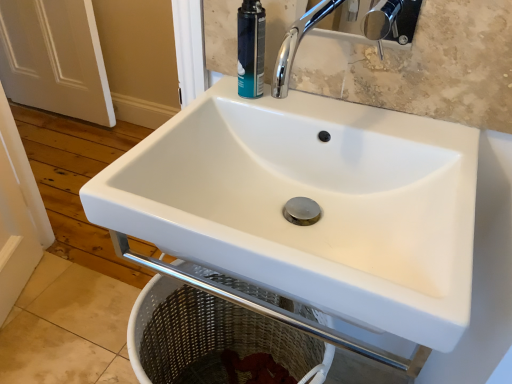
The image size is (512, 384). What do you see at coordinates (54, 58) in the screenshot?
I see `white matte door at left` at bounding box center [54, 58].

In order to click on white matte door at left in this screenshot , I will do pyautogui.click(x=54, y=58).

Locate an element on the screen. teal matte shaving cream can at upper center is located at coordinates (251, 49).

Does point (257, 37) lie in front of point (84, 89)?

Yes, point (257, 37) is closer to viewer.

Is teal matte shaving cream can at upper center completely or partially outside of white matte door at left?

Indeed, teal matte shaving cream can at upper center is completely outside white matte door at left.

Considering the sizes of objects teal matte shaving cream can at upper center and white matte door at left in the image provided, who is taller, teal matte shaving cream can at upper center or white matte door at left?

With more height is white matte door at left.

From the picture: Is teal matte shaving cream can at upper center to the left of white matte door at left from the viewer's perspective?

In fact, teal matte shaving cream can at upper center is to the right of white matte door at left.

Is point (263, 58) positioned before point (157, 238)?

That is False.

Is teal matte shaving cream can at upper center completely or partially outside of white ceramic sink at center?

Indeed, teal matte shaving cream can at upper center is completely outside white ceramic sink at center.

Considering the sizes of objects teal matte shaving cream can at upper center and white ceramic sink at center in the image provided, who is taller, teal matte shaving cream can at upper center or white ceramic sink at center?

Standing taller between the two is white ceramic sink at center.

Is white matte door at left spatially inside white ceramic sink at center, or outside of it?

white matte door at left is not inside white ceramic sink at center, it's outside.

Based on the photo, between white matte door at left and white ceramic sink at center, which one has smaller width?

With smaller width is white matte door at left.

Considering the relative positions of white matte door at left and white ceramic sink at center in the image provided, is white matte door at left to the right of white ceramic sink at center from the viewer's perspective?

No, white matte door at left is not to the right of white ceramic sink at center.

From the image's perspective, which object appears higher, white matte door at left or white ceramic sink at center?

From the image's view, white matte door at left is above.

Where is `toiletry on the left of the white ceramic sink at center`? The image size is (512, 384). toiletry on the left of the white ceramic sink at center is located at coordinates (251, 49).

How different are the orientations of white ceramic sink at center and teal matte shaving cream can at upper center in degrees?

They differ by 0.0431 degrees in their facing directions.

Based on the photo, does white ceramic sink at center appear on the left side of teal matte shaving cream can at upper center?

No.

Is white ceramic sink at center turned away from teal matte shaving cream can at upper center?

No, white ceramic sink at center is not facing away from teal matte shaving cream can at upper center.

Is white matte door at left smaller than teal matte shaving cream can at upper center?

Incorrect, white matte door at left is not smaller in size than teal matte shaving cream can at upper center.

Would you say white matte door at left is inside or outside teal matte shaving cream can at upper center?

white matte door at left is spatially situated outside teal matte shaving cream can at upper center.

Can you confirm if white matte door at left is thinner than teal matte shaving cream can at upper center?

In fact, white matte door at left might be wider than teal matte shaving cream can at upper center.

Would you say white matte door at left is a long distance from teal matte shaving cream can at upper center?

Yes.

From a real-world perspective, is white ceramic sink at center above or below white matte door at left?

From a real-world perspective, white ceramic sink at center is physically above white matte door at left.

Is white ceramic sink at center turned away from white matte door at left?

No, white ceramic sink at center's orientation is not away from white matte door at left.

What are the coordinates of `screen door behind the white ceramic sink at center` in the screenshot? It's located at (54, 58).

From the image's perspective, is white ceramic sink at center above white matte door at left?

No, from the image's perspective, white ceramic sink at center is not over white matte door at left.

You are a GUI agent. You are given a task and a screenshot of the screen. Output one action in this format:
    pyautogui.click(x=<x>, y=<y>)
    Task: Click on the toiletry that is above the white matte door at left (from a real-world perspective)
    This screenshot has width=512, height=384.
    Given the screenshot: What is the action you would take?
    pyautogui.click(x=251, y=49)

Locate an element on the screen. The width and height of the screenshot is (512, 384). toiletry behind the white ceramic sink at center is located at coordinates (251, 49).

From the image, which object appears to be nearer to white matte door at left, white ceramic sink at center or teal matte shaving cream can at upper center?

Among the two, white ceramic sink at center is located nearer to white matte door at left.

Which object lies further to the anchor point teal matte shaving cream can at upper center, white matte door at left or white ceramic sink at center?

The object further to teal matte shaving cream can at upper center is white matte door at left.

When comparing their distances from white ceramic sink at center, does white matte door at left or teal matte shaving cream can at upper center seem further?

white matte door at left.

Estimate the real-world distances between objects in this image. Which object is further from teal matte shaving cream can at upper center, white ceramic sink at center or white matte door at left?

white matte door at left is positioned further to the anchor teal matte shaving cream can at upper center.

From the image, which object appears to be nearer to white ceramic sink at center, teal matte shaving cream can at upper center or white matte door at left?

The object closer to white ceramic sink at center is teal matte shaving cream can at upper center.

Considering their positions, is teal matte shaving cream can at upper center positioned further to white matte door at left than white ceramic sink at center?

teal matte shaving cream can at upper center is positioned further to the anchor white matte door at left.

Find the location of a particular element. This screenshot has height=384, width=512. toiletry located between white ceramic sink at center and white matte door at left in the depth direction is located at coordinates (251, 49).